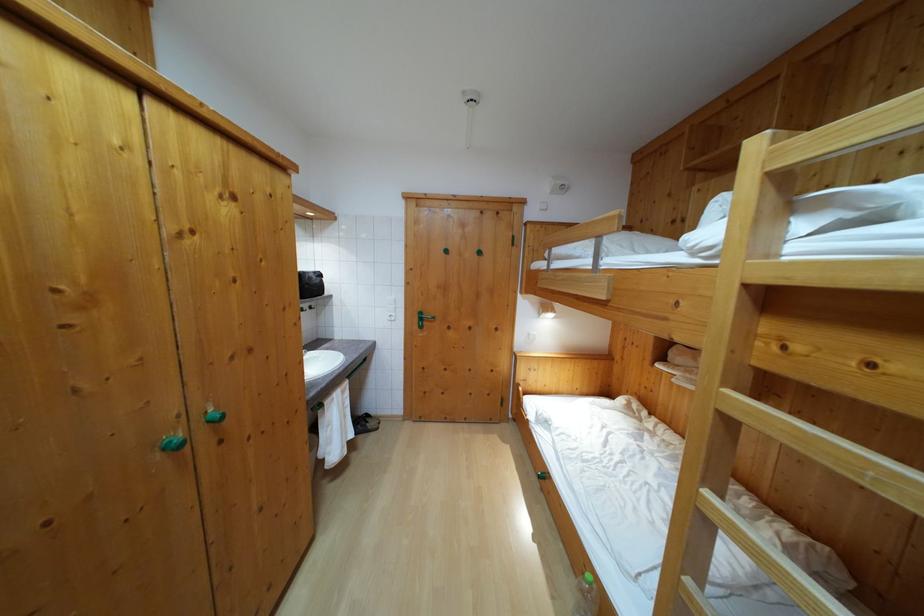
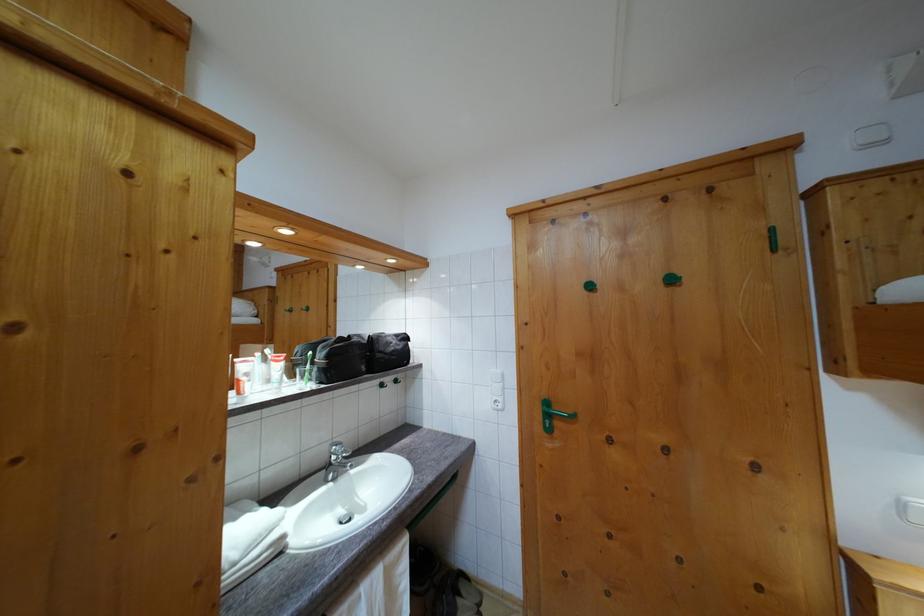
Locate, in the second image, the point that corresponds to the point at 450,259 in the first image.

(593, 294)